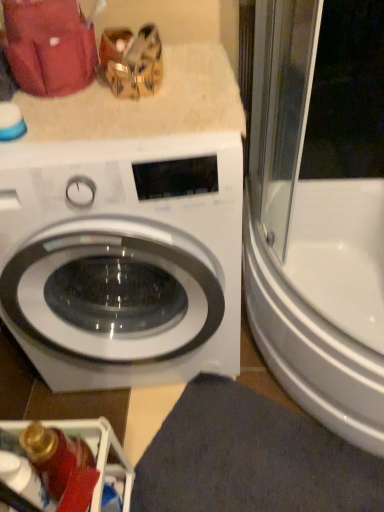
Question: From the image's perspective, would you say metallic silver dishwasher at lower left is shown under white glossy washing machine at center?

Choices:
 (A) no
 (B) yes

Answer: (B)

Question: From the image's perspective, would you say metallic silver dishwasher at lower left is positioned over white glossy washing machine at center?

Choices:
 (A) yes
 (B) no

Answer: (B)

Question: Does metallic silver dishwasher at lower left lie in front of white glossy washing machine at center?

Choices:
 (A) no
 (B) yes

Answer: (A)

Question: Is metallic silver dishwasher at lower left thinner than white glossy washing machine at center?

Choices:
 (A) yes
 (B) no

Answer: (A)

Question: Could you tell me if metallic silver dishwasher at lower left is facing white glossy washing machine at center?

Choices:
 (A) yes
 (B) no

Answer: (B)

Question: Is metallic silver dishwasher at lower left next to white glossy washing machine at center?

Choices:
 (A) yes
 (B) no

Answer: (B)

Question: Is white glossy washing machine at center not near dark gray fabric bath mat at lower center?

Choices:
 (A) yes
 (B) no

Answer: (B)

Question: Considering the relative sizes of white glossy washing machine at center and dark gray fabric bath mat at lower center in the image provided, is white glossy washing machine at center thinner than dark gray fabric bath mat at lower center?

Choices:
 (A) yes
 (B) no

Answer: (B)

Question: Considering the relative sizes of white glossy washing machine at center and dark gray fabric bath mat at lower center in the image provided, is white glossy washing machine at center bigger than dark gray fabric bath mat at lower center?

Choices:
 (A) no
 (B) yes

Answer: (B)

Question: Is white glossy washing machine at center positioned with its back to dark gray fabric bath mat at lower center?

Choices:
 (A) yes
 (B) no

Answer: (B)

Question: Is dark gray fabric bath mat at lower center inside white glossy washing machine at center?

Choices:
 (A) no
 (B) yes

Answer: (A)

Question: From the image's perspective, is white glossy washing machine at center above dark gray fabric bath mat at lower center?

Choices:
 (A) no
 (B) yes

Answer: (B)

Question: Is white glossy bathtub at right in contact with white glossy washing machine at center?

Choices:
 (A) no
 (B) yes

Answer: (A)